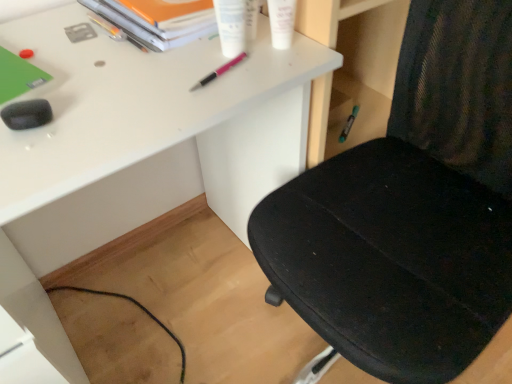
Question: From the image's perspective, is black mesh chair at right located above or below pink metallic pen at upper center, placed as the third stationery when sorted from back to front?

Choices:
 (A) above
 (B) below

Answer: (B)

Question: Based on their sizes in the image, would you say black mesh chair at right is bigger or smaller than pink metallic pen at upper center, the third stationery positioned from the left?

Choices:
 (A) small
 (B) big

Answer: (B)

Question: Which object is positioned closest to the white matte desk at center?

Choices:
 (A) white plastic tubes at upper center, which is counted as the third stationery, starting from the right
 (B) metallic silver pen at upper left, placed as the 2th stationery when sorted from back to front
 (C) white matte tube at upper center, positioned as the 2th stationery in right-to-left order
 (D) black mesh chair at right
 (E) teal plastic pen at center-right, arranged as the 1th stationery when viewed from the right

Answer: (D)

Question: Estimate the real-world distances between objects in this image. Which object is farther from the pink metallic pen at upper center, which is the 4th stationery from front to back?

Choices:
 (A) orange matte paper at upper center
 (B) white matte desk at center
 (C) white plastic tubes at upper center, which ranks as the 3th stationery in front-to-back order
 (D) metallic silver pen at upper left, the fifth stationery positioned from the front
 (E) white matte tube at upper center, which is counted as the second stationery, starting from the front

Answer: (B)